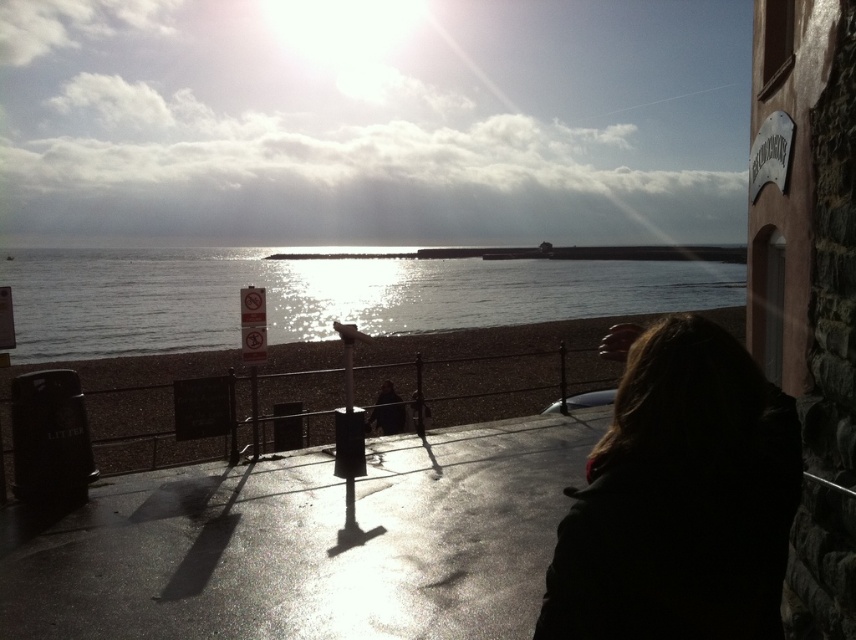
Question: Among these points, which one is nearest to the camera?

Choices:
 (A) (782, 426)
 (B) (64, 349)
 (C) (383, 352)

Answer: (A)

Question: Is glistening water at center wider than smooth sand at lower center?

Choices:
 (A) yes
 (B) no

Answer: (A)

Question: Is glistening water at center thinner than smooth sand at lower center?

Choices:
 (A) no
 (B) yes

Answer: (A)

Question: Which object is farther from the camera taking this photo?

Choices:
 (A) smooth sand at lower center
 (B) glistening water at center

Answer: (B)

Question: Which object is the closest to the dark brown hair at lower right?

Choices:
 (A) glistening water at center
 (B) smooth sand at lower center

Answer: (B)

Question: Considering the relative positions of glistening water at center and smooth sand at lower center in the image provided, where is glistening water at center located with respect to smooth sand at lower center?

Choices:
 (A) above
 (B) below

Answer: (A)